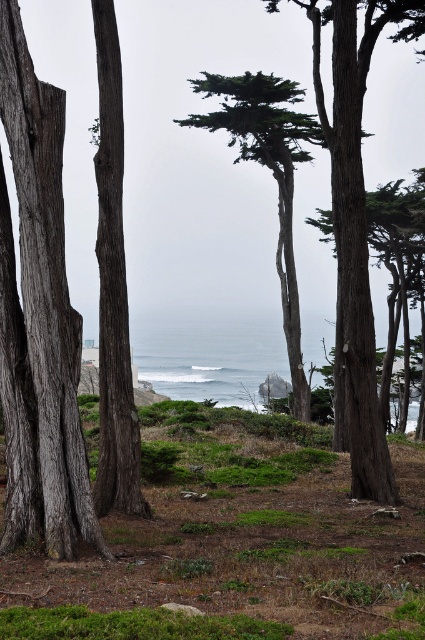
Does smooth gray bark tree at left lie behind smooth bark tree at center?

No, smooth gray bark tree at left is in front of smooth bark tree at center.

Is smooth gray bark tree at left below smooth bark tree at center?

Indeed, smooth gray bark tree at left is positioned under smooth bark tree at center.

Who is more distant from viewer, (99, 109) or (416, 364)?

The point (99, 109) is more distant.

Image resolution: width=425 pixels, height=640 pixels. Find the location of `smooth gray bark tree at left`. smooth gray bark tree at left is located at coordinates (113, 291).

The image size is (425, 640). What do you see at coordinates (272, 173) in the screenshot? I see `green textured tree at center` at bounding box center [272, 173].

Does green textured tree at center come behind smooth bark tree at center?

Yes, green textured tree at center is further from the viewer.

Is point (275, 170) less distant than point (405, 352)?

Yes, it is.

Locate an element on the screen. green textured tree at center is located at coordinates (272, 173).

Does smooth gray bark tree at left appear on the right side of green grassy at lower center?

In fact, smooth gray bark tree at left is to the left of green grassy at lower center.

Is point (113, 456) closer to viewer compared to point (65, 634)?

No, it is behind (65, 634).

Locate an element on the screen. This screenshot has width=425, height=640. smooth gray bark tree at left is located at coordinates (113, 291).

This screenshot has height=640, width=425. In order to click on smooth gray bark tree at left in this screenshot , I will do `click(113, 291)`.